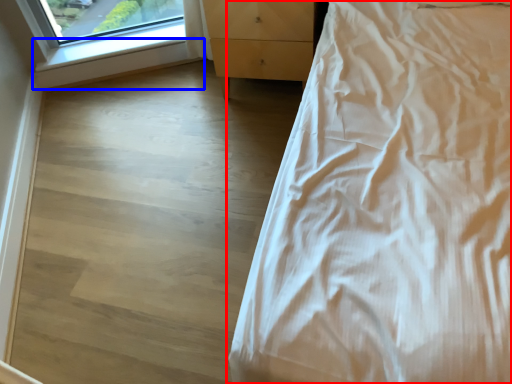
Question: Which point is closer to the camera, bed (highlighted by a red box) or window sill (highlighted by a blue box)?

Choices:
 (A) bed
 (B) window sill

Answer: (A)